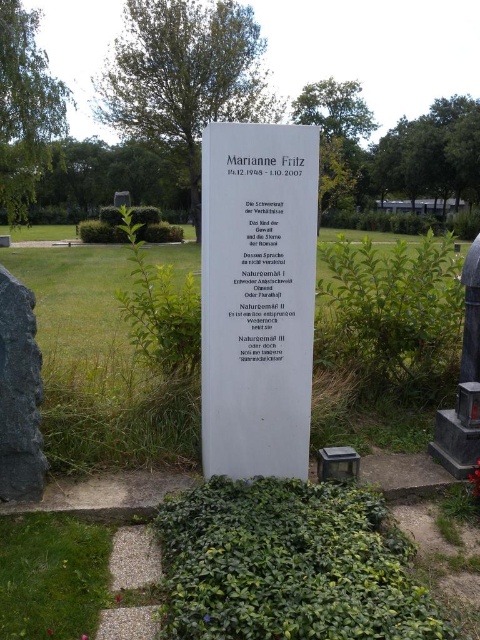
Question: Where is white stone plaque at center located in relation to black paper at center in the image?

Choices:
 (A) right
 (B) left

Answer: (B)

Question: Does black paper at center have a greater width compared to matte stone monument at right?

Choices:
 (A) no
 (B) yes

Answer: (B)

Question: Is white stone plaque at center wider than matte stone monument at right?

Choices:
 (A) no
 (B) yes

Answer: (B)

Question: Among these objects, which one is nearest to the camera?

Choices:
 (A) white stone plaque at center
 (B) matte stone monument at right

Answer: (A)

Question: Based on their relative distances, which object is nearer to the white stone plaque at center?

Choices:
 (A) black paper at center
 (B) matte stone monument at right

Answer: (A)

Question: Based on their relative distances, which object is farther from the white stone plaque at center?

Choices:
 (A) matte stone monument at right
 (B) black paper at center

Answer: (A)